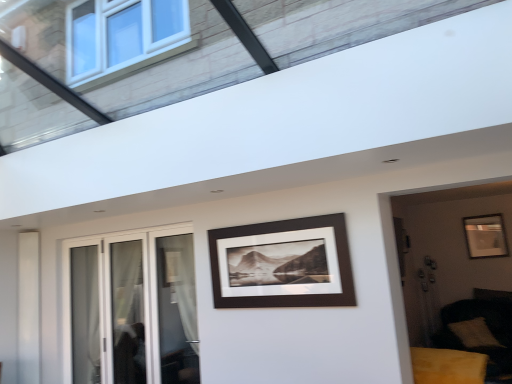
Question: Considering the positions of matte black picture frame at right, placed as the 2th picture frame when sorted from front to back, and white glass door at left in the image, is matte black picture frame at right, placed as the 2th picture frame when sorted from front to back, taller or shorter than white glass door at left?

Choices:
 (A) tall
 (B) short

Answer: (B)

Question: Looking at their shapes, would you say matte black picture frame at right, the 1th picture frame in the right-to-left sequence, is wider or thinner than white glass door at left?

Choices:
 (A) thin
 (B) wide

Answer: (B)

Question: Based on their relative distances, which object is nearer to the yellow velvet sofa at lower right?

Choices:
 (A) matte black picture frame at right, placed as the 2th picture frame when sorted from front to back
 (B) white glass door at left
 (C) matte black picture frame at center, which is counted as the 2th picture frame, starting from the right
 (D) soft beige cushion at lower right

Answer: (C)

Question: Estimate the real-world distances between objects in this image. Which object is farther from the matte black picture frame at right, placed as the 2th picture frame when sorted from front to back?

Choices:
 (A) soft beige cushion at lower right
 (B) matte black picture frame at center, which is counted as the 2th picture frame, starting from the right
 (C) yellow velvet sofa at lower right
 (D) white glass door at left

Answer: (D)